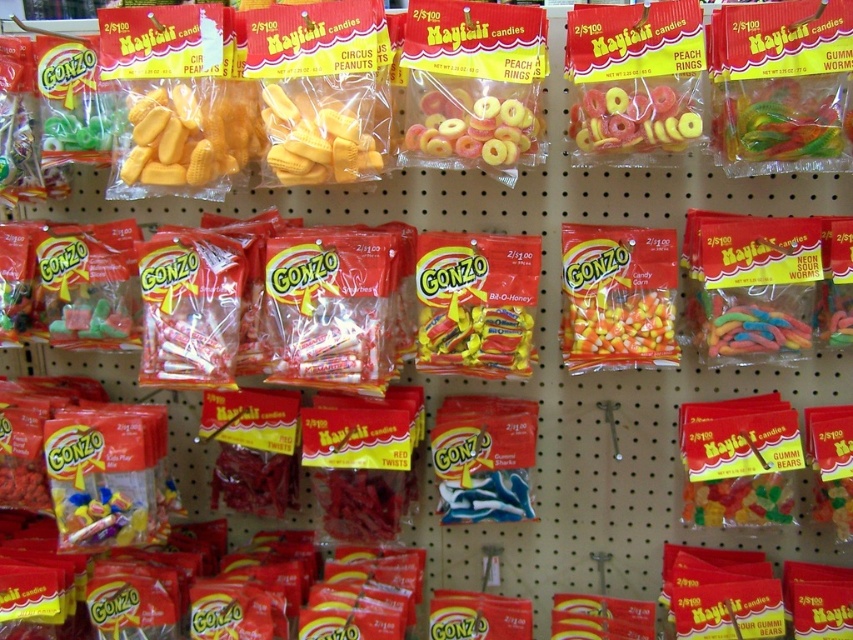
From the picture: You are a customer in the store looking at the pegboard shelf. You want to buy the translucent rubber rings at center. Where should you look on the shelf?

The translucent rubber rings at center are located at point (x=473, y=125) on the shelf.

In the scene shown: You are a customer at the candy store and want to buy a candy that is wider than the other. Which candy should you choose between the translucent rubber rings at center and the yellow rubber gummy at center?

The translucent rubber rings at center is wider than the yellow rubber gummy at center, so you should choose the translucent rubber rings at center.